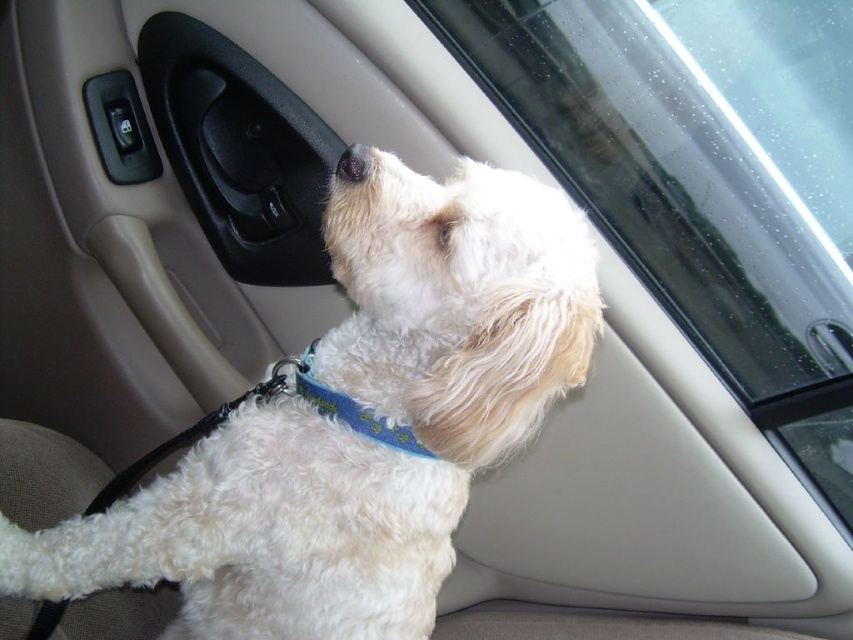
You are a dog trainer who wants to place a treat on the car seat. The treat must be placed exactly at point (358, 422). Where should you put the treat?

The point (358, 422) is on the white fluffy dog at center, so you should place the treat on the white fluffy dog at center.

You are a passenger in the car and notice the transparent glass window at upper right and the black fur at upper center. Which object is closer to the driver side of the car?

The black fur at upper center is closer to the driver side of the car because the transparent glass window at upper right is to the right of it.